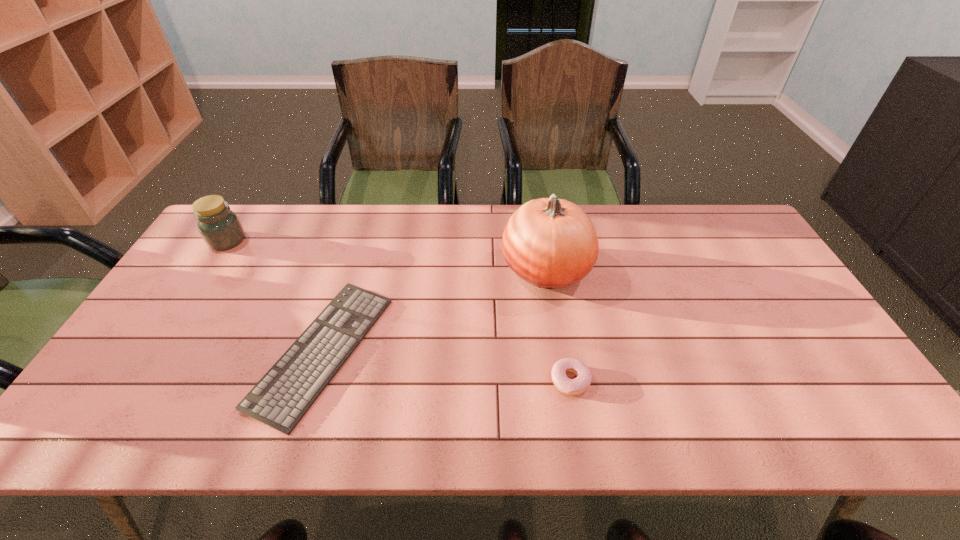
Image resolution: width=960 pixels, height=540 pixels. Identify the location of empty location between the third shortest object and the third object from right to left. (276, 296).

Image resolution: width=960 pixels, height=540 pixels. In order to click on unoccupied position between the pumpkin and the second object from left to right in this screenshot , I will do `click(435, 310)`.

Locate an element on the screen. The image size is (960, 540). vacant space that is in between the third shortest object and the third tallest object is located at coordinates (398, 310).

The image size is (960, 540). I want to click on vacant region between the tallest object and the doughnut, so click(x=559, y=325).

The image size is (960, 540). Identify the location of vacant area that lies between the second shortest object and the second tallest object. (398, 310).

Find the location of a particular element. The height and width of the screenshot is (540, 960). free space between the tallest object and the leftmost object is located at coordinates (387, 255).

At what (x,y) coordinates should I click in order to perform the action: click on vacant region between the leftmost object and the tallest object. Please return your answer as a coordinate pair (x, y). The height and width of the screenshot is (540, 960). Looking at the image, I should click on (387, 255).

At what (x,y) coordinates should I click in order to perform the action: click on free space between the third tallest object and the shortest object. Please return your answer as a coordinate pair (x, y). This screenshot has height=540, width=960. Looking at the image, I should click on (447, 366).

Where is `vacant area that lies between the shortest object and the jar`? The width and height of the screenshot is (960, 540). vacant area that lies between the shortest object and the jar is located at coordinates (276, 296).

Select which object is the second closest to the shortest object. Please provide its 2D coordinates. Your answer should be formatted as a tuple, i.e. [(x, y)], where the tuple contains the x and y coordinates of a point satisfying the conditions above.

[(551, 243)]